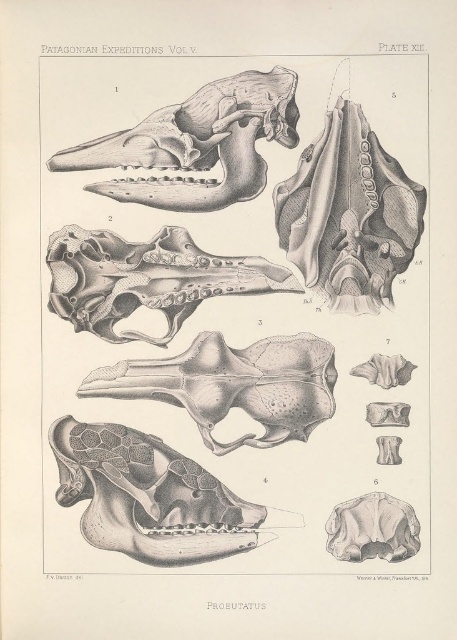
Between gray textured skull at center and gray bone skull at center, which one has less height?

With less height is gray bone skull at center.

Is point (122, 396) positioned in front of point (368, 508)?

That is False.

Locate an element on the screen. gray textured skull at center is located at coordinates (233, 385).

Which is above, gray/smooth skull at center or gray bone skull at center?

gray/smooth skull at center is higher up.

Is gray/smooth skull at center positioned in front of gray bone skull at center?

No.

Where is `gray/smooth skull at center`? gray/smooth skull at center is located at coordinates (145, 278).

Is gray bone skull at upper center thinner than gray bone skull at center?

No, gray bone skull at upper center is not thinner than gray bone skull at center.

Based on the photo, can you confirm if gray bone skull at upper center is taller than gray bone skull at center?

Yes, gray bone skull at upper center is taller than gray bone skull at center.

You are a GUI agent. You are given a task and a screenshot of the screen. Output one action in this format:
    pyautogui.click(x=<x>, y=<y>)
    Task: Click on the gray bone skull at upper center
    
    Given the screenshot: What is the action you would take?
    pyautogui.click(x=196, y=145)